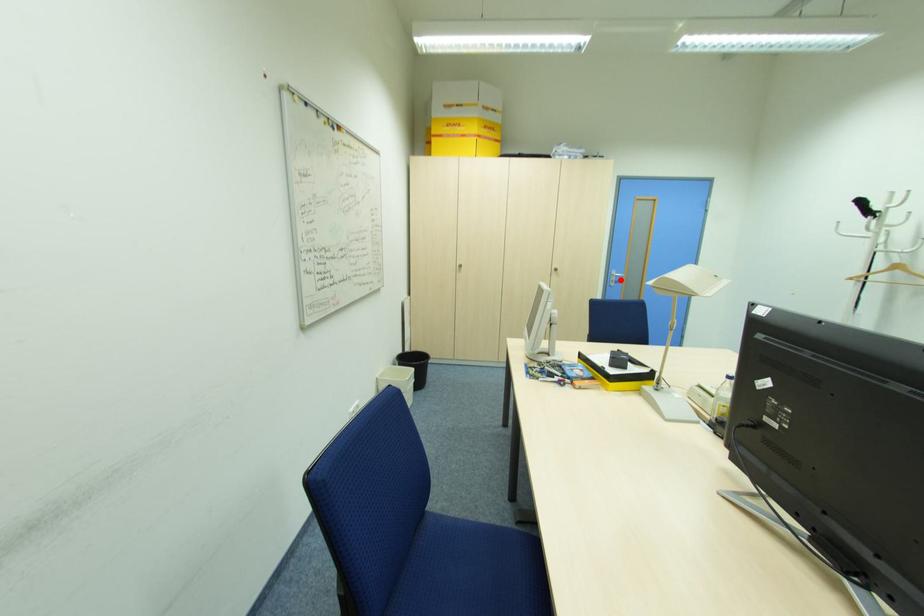
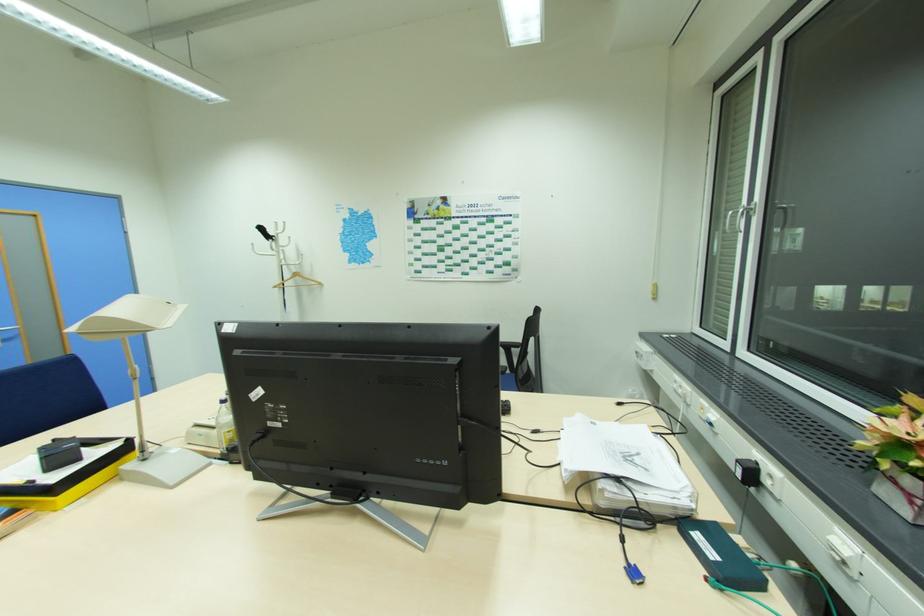
Question: I am providing you with two images of the same scene from different viewpoints. A red point is marked on the first image. Is the red point's position out of view in image 2?

Choices:
 (A) Yes
 (B) No

Answer: (B)